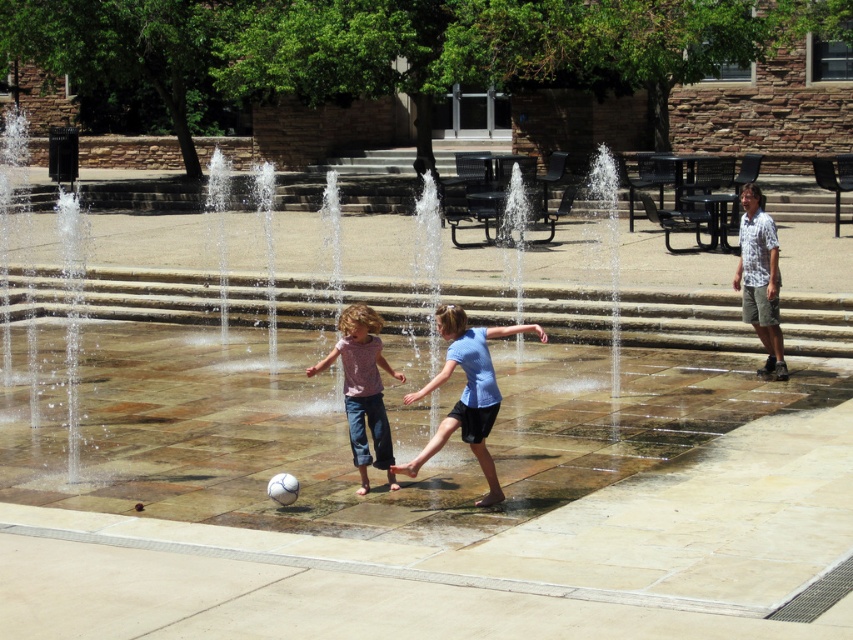
Looking at this image, can you confirm if blue matte shirt at center is smaller than denim pants at center?

No.

Does blue matte shirt at center have a lesser width compared to denim pants at center?

No.

This screenshot has width=853, height=640. Describe the element at coordinates (466, 392) in the screenshot. I see `blue matte shirt at center` at that location.

Where is `blue matte shirt at center`? blue matte shirt at center is located at coordinates (466, 392).